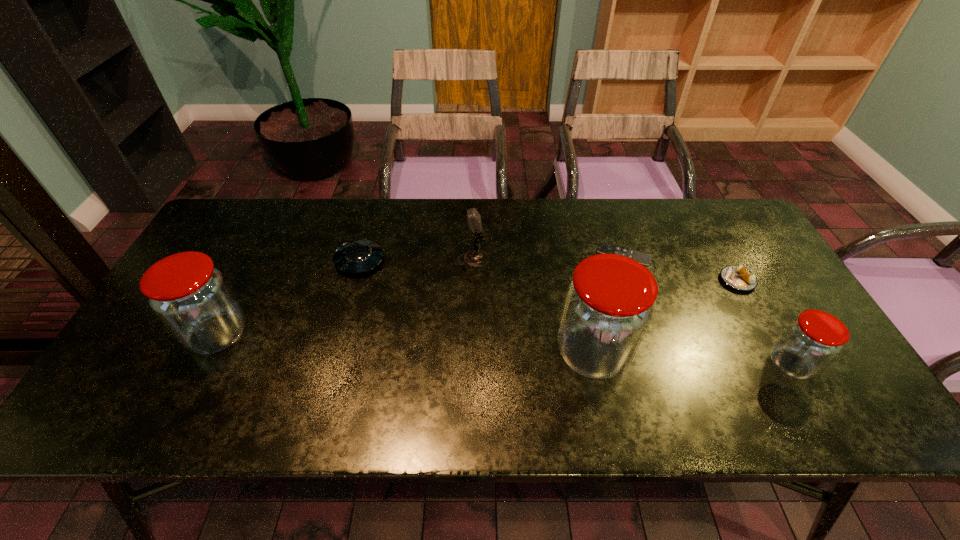
At what (x,y) coordinates should I click in order to perform the action: click on jar object that ranks as the third closest to the pastry. Please return your answer as a coordinate pair (x, y). Looking at the image, I should click on (191, 297).

Identify the location of free space that satisfies the following two spatial constraints: 1. on the front-facing side of the second shortest object; 2. on the left side of the third object from left to right. This screenshot has height=540, width=960. (473, 281).

I want to click on free spot that satisfies the following two spatial constraints: 1. on the back side of the sixth tallest object; 2. on the left side of the second jar from right to left, so (577, 281).

Identify the location of free space in the image that satisfies the following two spatial constraints: 1. on the back side of the shortest jar; 2. on the front-facing side of the microphone. (732, 260).

Where is `vacant space that satisfies the following two spatial constraints: 1. on the front-facing side of the microphone; 2. on the back side of the rightmost jar`? Image resolution: width=960 pixels, height=540 pixels. vacant space that satisfies the following two spatial constraints: 1. on the front-facing side of the microphone; 2. on the back side of the rightmost jar is located at coordinates (471, 364).